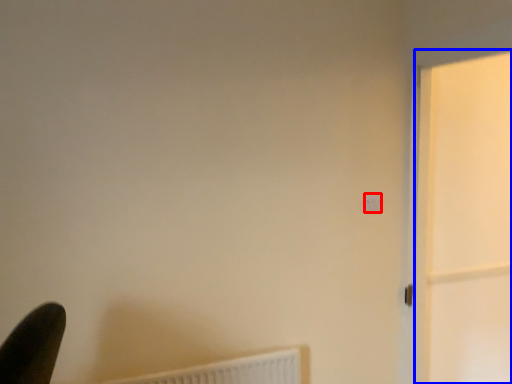
Question: Which of the following is the closest to the observer, light switch (highlighted by a red box) or screen door (highlighted by a blue box)?

Choices:
 (A) light switch
 (B) screen door

Answer: (B)